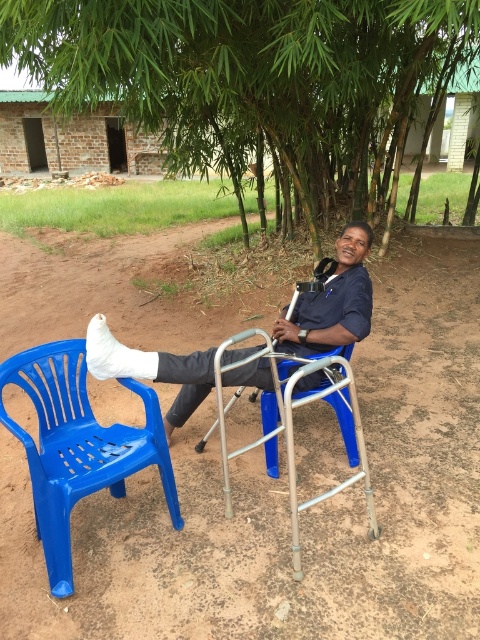
You are a construction worker standing near the partially constructed brick building with an unfinished roof. You need to move the blue plastic chair at center so that it is no longer blocked by the green bamboo at center. Which direction should you move it?

The blue plastic chair at center is currently behind the green bamboo at center. To unblock it, move the blue plastic chair at center forward, away from the green bamboo at center so it is in front of the bamboo.

You are a caregiver trying to choose a chair for the man to sit on. The man needs a chair that is stable and can support his weight. Which chair between the blue plastic chair at lower left and the blue plastic chair at center would you recommend based on their sizes?

The blue plastic chair at center is larger and therefore more stable and capable of supporting the man better than the blue plastic chair at lower left, so the caregiver should choose the blue plastic chair at center.

You are standing at the center of the image. Which direction should you walk to reach the blue plastic chair at lower left?

You should walk towards the lower left direction to reach the blue plastic chair at lower left.